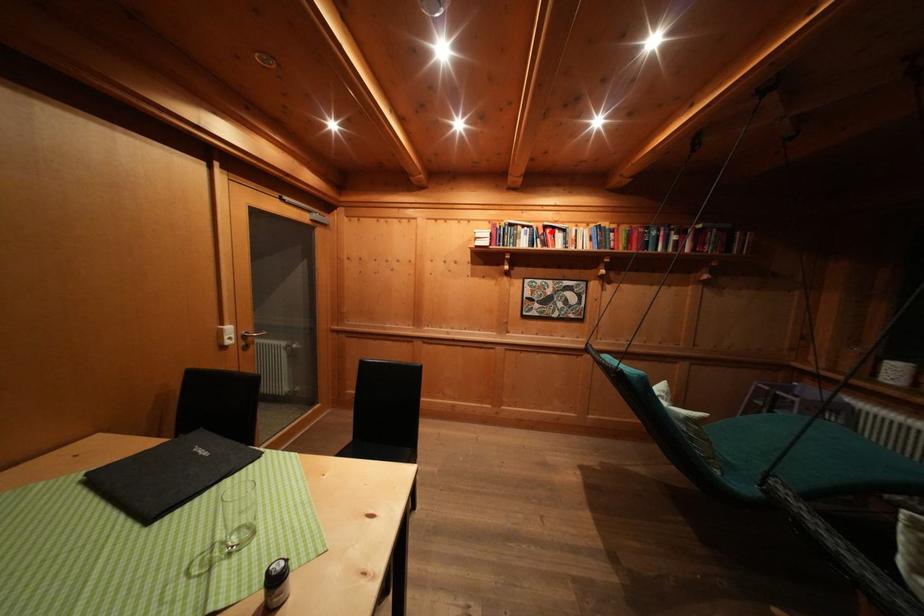
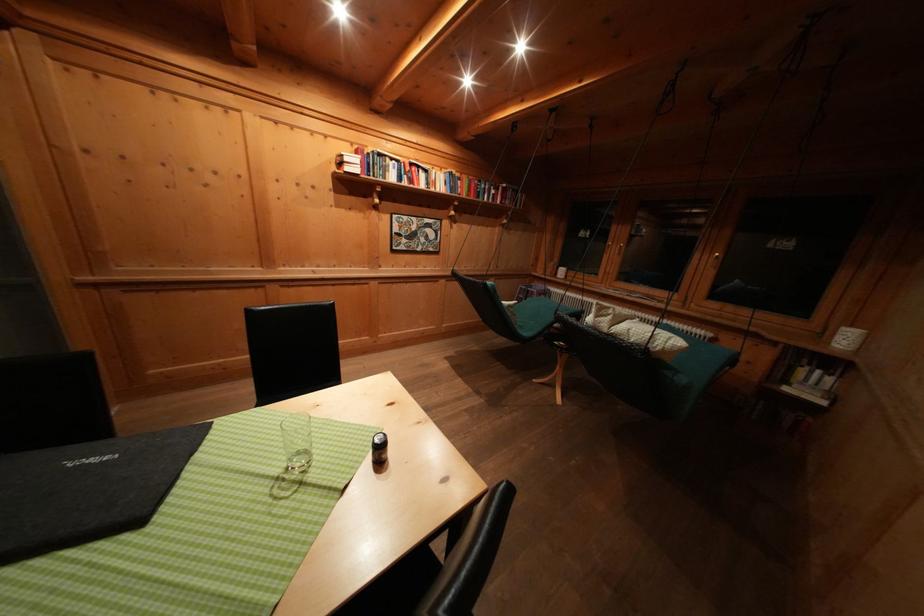
Find the pixel in the second image that matches the highlighted location in the first image.

(418, 169)